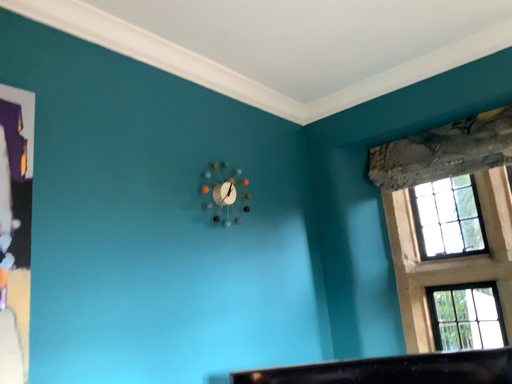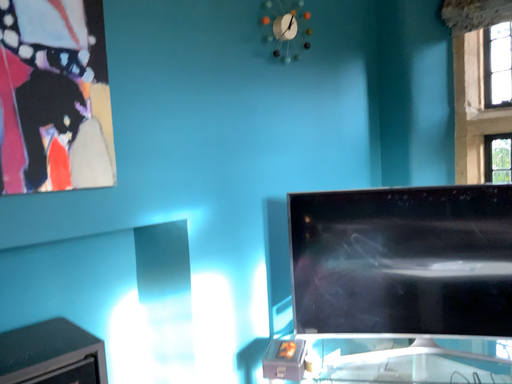
Question: How did the camera likely rotate when shooting the video?

Choices:
 (A) rotated upward
 (B) rotated downward

Answer: (B)